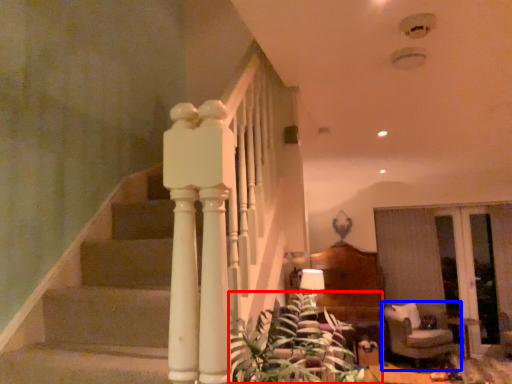
Question: Which point is closer to the camera, plant (highlighted by a red box) or furniture (highlighted by a blue box)?

Choices:
 (A) plant
 (B) furniture

Answer: (A)